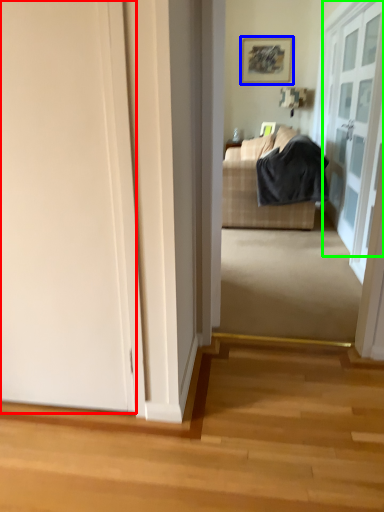
Question: Based on their relative distances, which object is farther from door (highlighted by a red box)? Choose from picture frame (highlighted by a blue box) and door (highlighted by a green box).

Choices:
 (A) picture frame
 (B) door

Answer: (A)